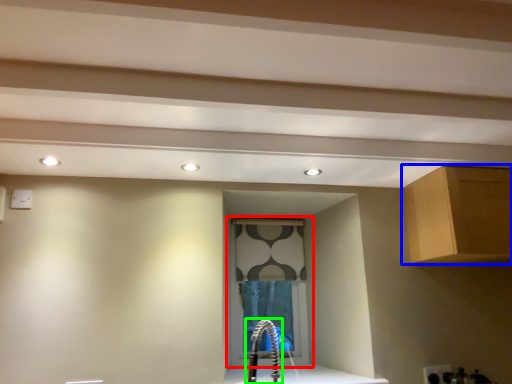
Question: Which object is the closest to the window (highlighted by a red box)? Choose among these: cabinetry (highlighted by a blue box) or faucet (highlighted by a green box).

Choices:
 (A) cabinetry
 (B) faucet

Answer: (B)